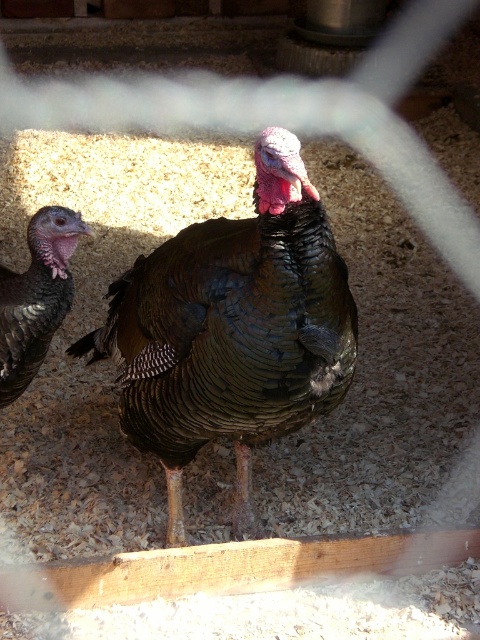
Question: Which of the following is the closest to the observer?

Choices:
 (A) (29, 348)
 (B) (144, 406)

Answer: (B)

Question: Does shiny dark brown turkey at center have a greater width compared to shiny brown turkey at left?

Choices:
 (A) yes
 (B) no

Answer: (A)

Question: Can you confirm if shiny dark brown turkey at center is wider than shiny brown turkey at left?

Choices:
 (A) yes
 (B) no

Answer: (A)

Question: Does shiny dark brown turkey at center have a greater width compared to shiny brown turkey at left?

Choices:
 (A) yes
 (B) no

Answer: (A)